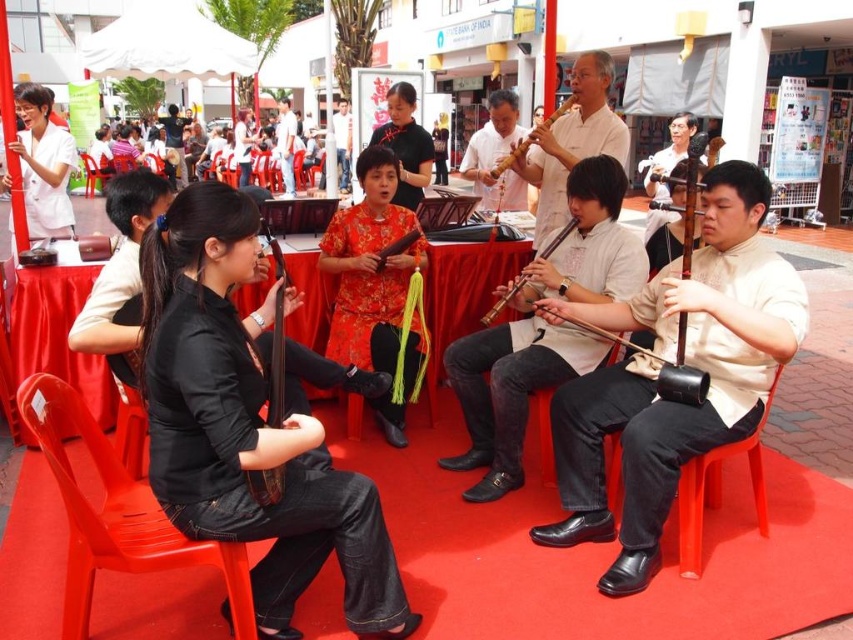
Question: Which of the following is the closest to the observer?

Choices:
 (A) (102, 177)
 (B) (154, 476)
 (C) (74, 584)
 (D) (556, 116)

Answer: (B)

Question: Does red satin dress at center come behind wooden violin at center?

Choices:
 (A) no
 (B) yes

Answer: (B)

Question: Which point is closer to the camera taking this photo?

Choices:
 (A) (717, 364)
 (B) (93, 186)

Answer: (A)

Question: From the image, what is the correct spatial relationship of matte white shirt at center in relation to matte brown wooden instrument at center?

Choices:
 (A) above
 (B) below

Answer: (B)

Question: Can you confirm if black matte guitar at center is bigger than red satin dress at center?

Choices:
 (A) no
 (B) yes

Answer: (A)

Question: Which point is farther to the camera?

Choices:
 (A) (189, 557)
 (B) (521, 435)
 (C) (480, 321)

Answer: (C)